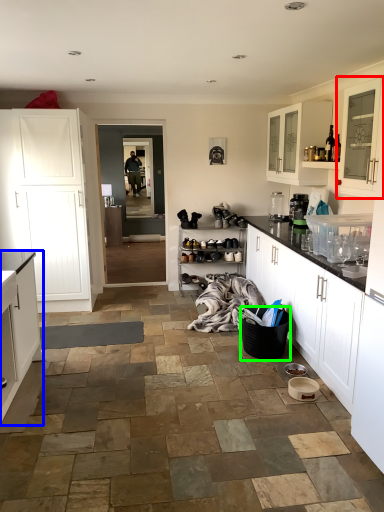
Question: Estimate the real-world distances between objects in this image. Which object is closer to cabinetry (highlighted by a red box), cabinetry (highlighted by a blue box) or basket (highlighted by a green box)?

Choices:
 (A) cabinetry
 (B) basket

Answer: (B)